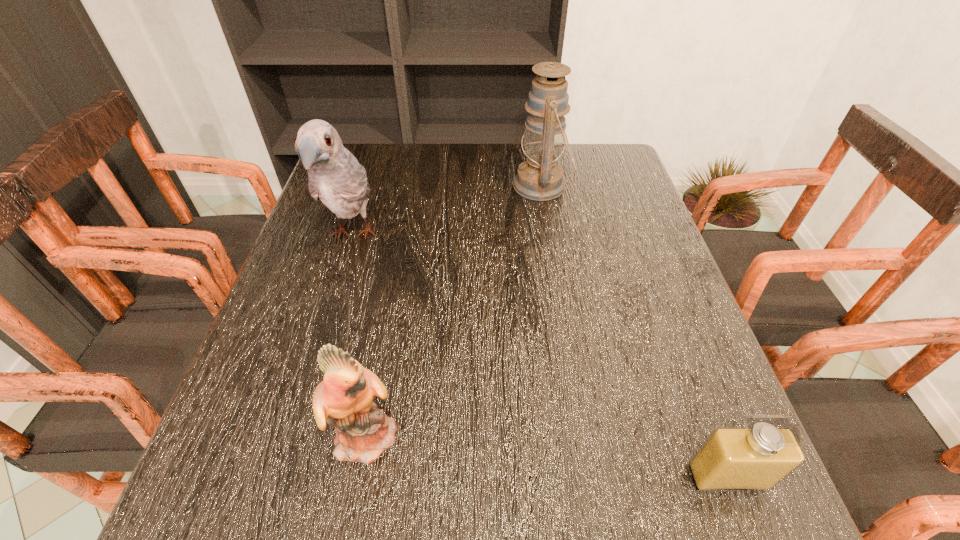
Where is `object at the far edge`? The width and height of the screenshot is (960, 540). object at the far edge is located at coordinates (540, 178).

Where is `parrot located in the near edge section of the desktop`? parrot located in the near edge section of the desktop is located at coordinates (344, 399).

Find the location of a particular element. This screenshot has width=960, height=540. perfume that is at the near edge is located at coordinates (755, 458).

Identify the location of object present at the left edge. (335, 177).

This screenshot has width=960, height=540. I want to click on object located in the right edge section of the desktop, so point(755,458).

At what (x,y) coordinates should I click in order to perform the action: click on object situated at the near right corner. Please return your answer as a coordinate pair (x, y). The image size is (960, 540). Looking at the image, I should click on (755, 458).

Find the location of `vacant space at the far edge of the desktop`. vacant space at the far edge of the desktop is located at coordinates (437, 181).

In the image, there is a desktop. Where is `vacant region at the near edge`? The image size is (960, 540). vacant region at the near edge is located at coordinates (546, 516).

In order to click on free space at the left edge of the desktop in this screenshot , I will do `click(273, 384)`.

Image resolution: width=960 pixels, height=540 pixels. In order to click on vacant space at the right edge of the desktop in this screenshot , I will do `click(616, 206)`.